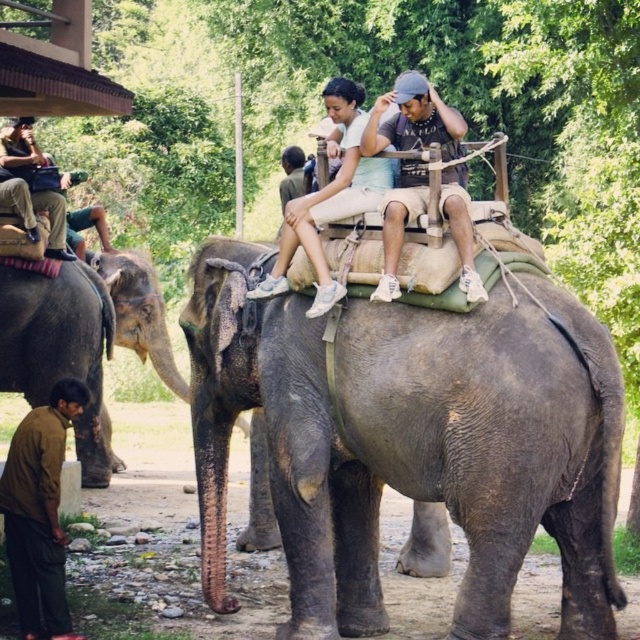
Does gray textured elephant at lower left appear over dark gray fabric hat at upper center?

Actually, gray textured elephant at lower left is below dark gray fabric hat at upper center.

Between point (28, 400) and point (401, 168), which one is positioned behind?

Positioned behind is point (28, 400).

This screenshot has width=640, height=640. Find the location of `gray textured elephant at lower left`. gray textured elephant at lower left is located at coordinates [x=83, y=339].

Does gray matte elephant at center appear on the right side of gray textured elephant at lower left?

Indeed, gray matte elephant at center is positioned on the right side of gray textured elephant at lower left.

The width and height of the screenshot is (640, 640). Describe the element at coordinates (410, 440) in the screenshot. I see `gray matte elephant at center` at that location.

Identify the location of gray matte elephant at center. The width and height of the screenshot is (640, 640). (410, 440).

Between dark gray fabric hat at upper center and matte brown pants at left, which one has less height?

Standing shorter between the two is dark gray fabric hat at upper center.

In the scene shown: Can you confirm if dark gray fabric hat at upper center is positioned below matte brown pants at left?

Indeed, dark gray fabric hat at upper center is positioned under matte brown pants at left.

You are a GUI agent. You are given a task and a screenshot of the screen. Output one action in this format:
    pyautogui.click(x=<x>, y=<y>)
    Task: Click on the dark gray fabric hat at upper center
    Image resolution: width=640 pixels, height=640 pixels.
    Given the screenshot: What is the action you would take?
    pyautogui.click(x=413, y=120)